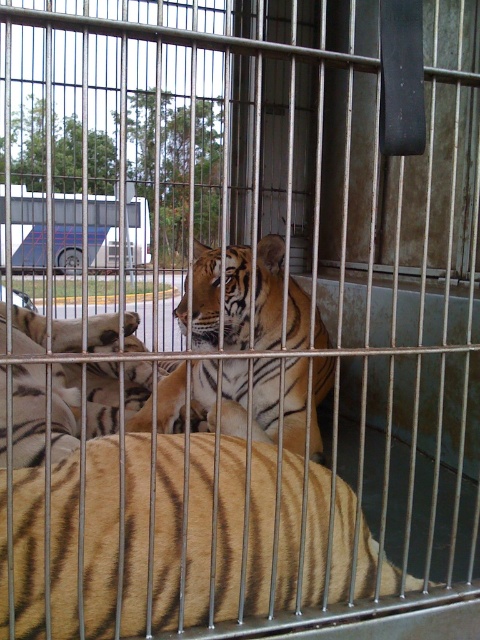
Who is shorter, golden fur tiger at center or orange-brown fur tiger at center?

Standing shorter between the two is golden fur tiger at center.

Is golden fur tiger at center closer to camera compared to orange-brown fur tiger at center?

Yes, golden fur tiger at center is in front of orange-brown fur tiger at center.

Looking at this image, who is more distant from viewer, (x=159, y=554) or (x=263, y=388)?

The point (x=263, y=388) is behind.

Find the location of a particular element. golden fur tiger at center is located at coordinates (177, 538).